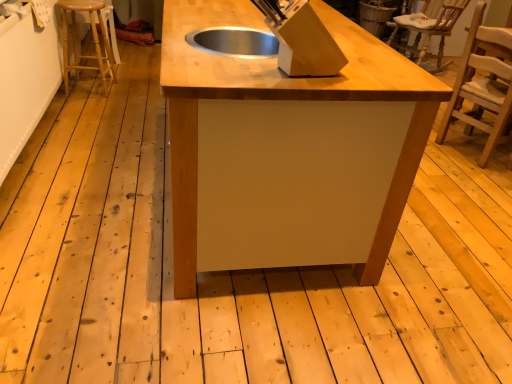
Locate an element on the screen. vacant area to the right of light brown wooden stool at left is located at coordinates (127, 94).